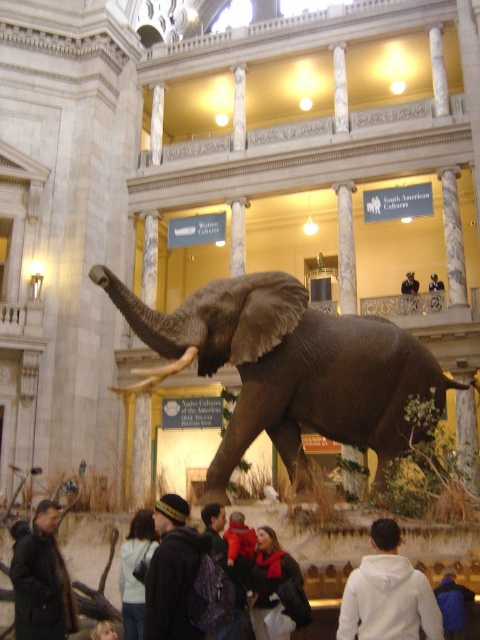
You are standing in the grand classical building and want to take a photo of the gray textured elephant at center. If your camera has a maximum zoom range of 20 meters, will you be able to capture the elephant clearly without moving closer?

The gray textured elephant at center is 26.46 meters away from the viewer. Since the camera can only zoom up to 20 meters, you will not be able to capture the elephant clearly without moving closer.

You are a visitor in the museum and want to take a photo of the light brown leather jacket at lower center without the gray textured elephant at center blocking the view. Is this possible?

The gray textured elephant at center is positioned over light brown leather jacket at lower center, so it is blocking the jacket. Therefore, it is not possible to take a photo of the light brown leather jacket at lower center without the elephant blocking the view.

You are a visitor in the museum and want to take a photo of the dark brown leather jacket at center. Where should you stand to get the best view?

The dark brown leather jacket at center is located at point (275, 588), so standing directly in front of that coordinate would provide the best view.